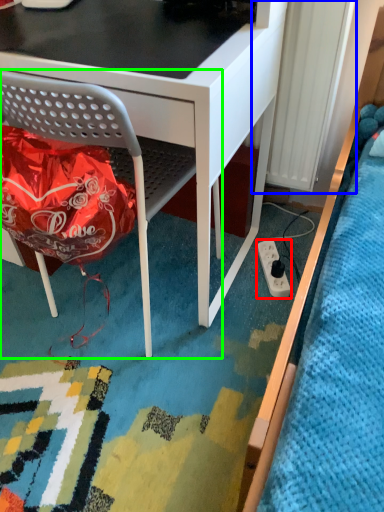
Question: Which object is the closest to the power plugs and sockets (highlighted by a red box)? Choose among these: radiator (highlighted by a blue box) or chair (highlighted by a green box).

Choices:
 (A) radiator
 (B) chair

Answer: (A)